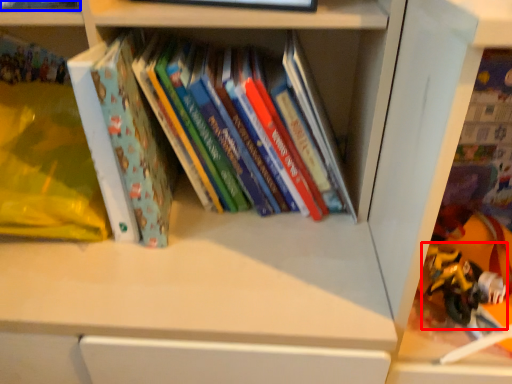
Question: Among these objects, which one is farthest to the camera, toy (highlighted by a red box) or book (highlighted by a blue box)?

Choices:
 (A) toy
 (B) book

Answer: (A)